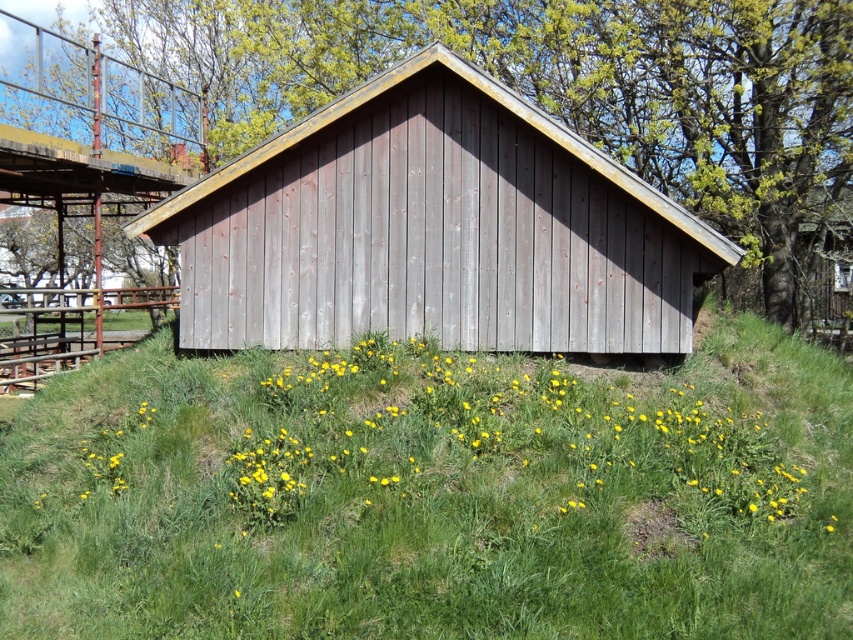
Question: Considering the relative positions of green grassy at center and weathered wood hut at center in the image provided, where is green grassy at center located with respect to weathered wood hut at center?

Choices:
 (A) right
 (B) left

Answer: (A)

Question: Is green grassy at center behind weathered wood hut at center?

Choices:
 (A) yes
 (B) no

Answer: (A)

Question: Does green grassy at center come behind weathered wood hut at center?

Choices:
 (A) yes
 (B) no

Answer: (A)

Question: Among these objects, which one is farthest from the camera?

Choices:
 (A) green grassy at center
 (B) weathered wood hut at center

Answer: (A)